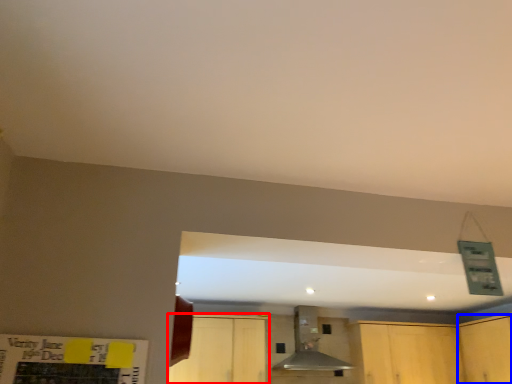
Question: Which of the following is the farthest to the observer, cabinetry (highlighted by a red box) or cabinetry (highlighted by a blue box)?

Choices:
 (A) cabinetry
 (B) cabinetry

Answer: (A)